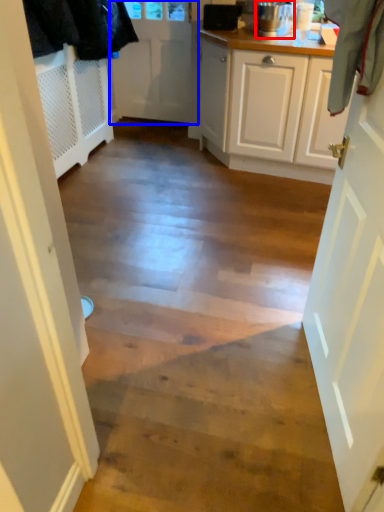
Question: Which object appears farthest to the camera in this image, kitchen appliance (highlighted by a red box) or door (highlighted by a blue box)?

Choices:
 (A) kitchen appliance
 (B) door

Answer: (B)